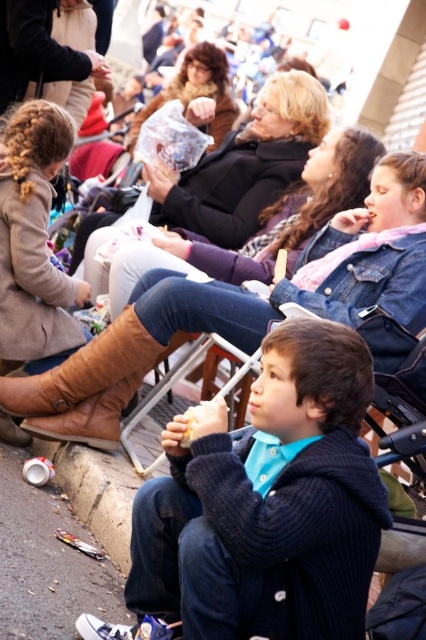
Consider the image. Does knitted dark blue sweater at center appear over white paper sandwich at center?

Incorrect, knitted dark blue sweater at center is not positioned above white paper sandwich at center.

Looking at this image, does knitted dark blue sweater at center appear on the right side of white paper sandwich at center?

No, knitted dark blue sweater at center is not to the right of white paper sandwich at center.

Is point (284, 614) closer to viewer compared to point (201, 406)?

Yes, it is in front of point (201, 406).

Find the location of `knitted dark blue sweater at center`. knitted dark blue sweater at center is located at coordinates (268, 502).

How far apart are leather boot at lower left and matte brown hair at center?

leather boot at lower left is 69.80 feet from matte brown hair at center.

Is leather boot at lower left smaller than matte brown hair at center?

Yes.

Describe the element at coordinates (86, 371) in the screenshot. This screenshot has height=640, width=426. I see `leather boot at lower left` at that location.

The image size is (426, 640). Identify the location of leather boot at lower left. (86, 371).

Does point (186, 108) come farther from viewer compared to point (186, 445)?

Yes, point (186, 108) is farther from viewer.

At what (x,y) coordinates should I click in order to perform the action: click on matte brown hair at center. Please return your answer as a coordinate pair (x, y). The width and height of the screenshot is (426, 640). Looking at the image, I should click on (195, 92).